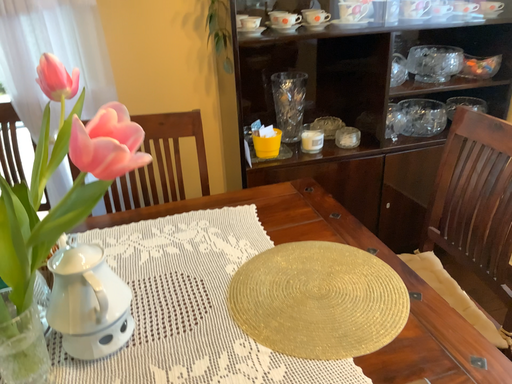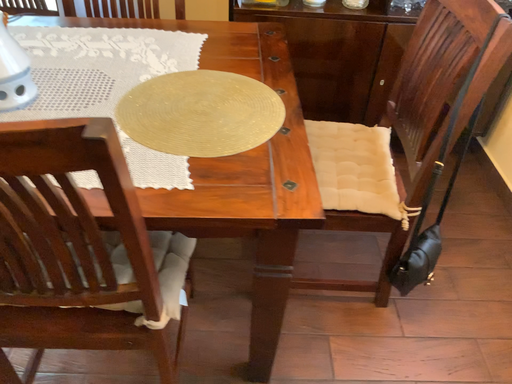
Question: How did the camera likely rotate when shooting the video?

Choices:
 (A) rotated downward
 (B) rotated upward

Answer: (A)